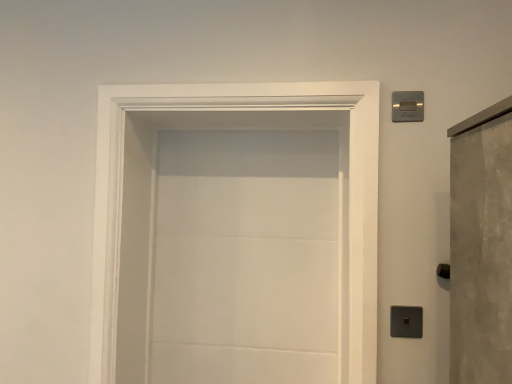
Question: From the image's perspective, does white matte door at center appear lower than satin silver switch at upper right?

Choices:
 (A) yes
 (B) no

Answer: (A)

Question: Is white matte door at center at the right side of satin silver switch at upper right?

Choices:
 (A) yes
 (B) no

Answer: (B)

Question: Can you confirm if white matte door at center is bigger than satin silver switch at upper right?

Choices:
 (A) yes
 (B) no

Answer: (A)

Question: From the image's perspective, is white matte door at center over satin silver switch at upper right?

Choices:
 (A) yes
 (B) no

Answer: (B)

Question: Is white matte door at center beside satin silver switch at upper right?

Choices:
 (A) no
 (B) yes

Answer: (A)

Question: Is satin silver switch at upper right at the back of white matte door at center?

Choices:
 (A) no
 (B) yes

Answer: (A)

Question: From a real-world perspective, is satin silver switch at upper right located beneath white matte door at center?

Choices:
 (A) yes
 (B) no

Answer: (B)

Question: From the image's perspective, does satin silver switch at upper right appear higher than white matte door at center?

Choices:
 (A) no
 (B) yes

Answer: (B)

Question: From the image's perspective, does satin silver switch at upper right appear lower than white matte door at center?

Choices:
 (A) yes
 (B) no

Answer: (B)

Question: Considering the relative sizes of satin silver switch at upper right and white matte door at center in the image provided, is satin silver switch at upper right shorter than white matte door at center?

Choices:
 (A) no
 (B) yes

Answer: (B)

Question: Is white matte door at center at the back of satin silver switch at upper right?

Choices:
 (A) no
 (B) yes

Answer: (A)

Question: Is satin silver switch at upper right behind white matte door at center?

Choices:
 (A) yes
 (B) no

Answer: (A)

Question: From a real-world perspective, is satin silver switch at upper right positioned above or below white matte door at center?

Choices:
 (A) below
 (B) above

Answer: (B)